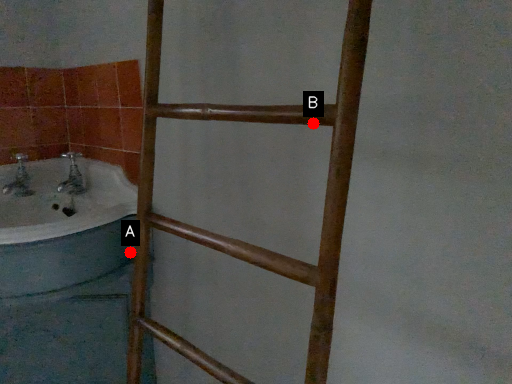
Question: Two points are circled on the image, labeled by A and B beside each circle. Which of the following is the closest to the observer?

Choices:
 (A) A is closer
 (B) B is closer

Answer: (B)